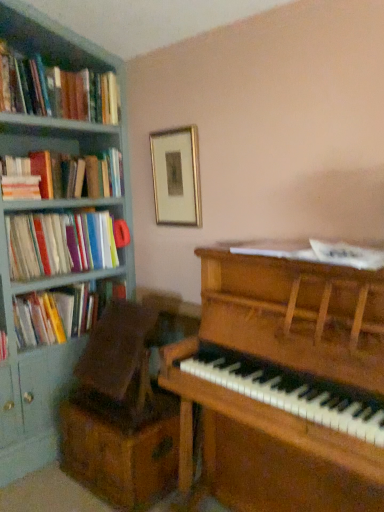
Question: Should I look upward or downward to see hardcover books at left, placed as the first book when sorted from top to bottom?

Choices:
 (A) up
 (B) down

Answer: (A)

Question: Is hardcover books at left, the 3th book in the top-to-bottom sequence, wider than hardcover books at left, placed as the first book when sorted from top to bottom?

Choices:
 (A) no
 (B) yes

Answer: (A)

Question: Is hardcover books at left, marked as the 2th book in a bottom-to-top arrangement, outside hardcover books at left, positioned as the fourth book in bottom-to-top order?

Choices:
 (A) yes
 (B) no

Answer: (A)

Question: Could you tell me if hardcover books at left, the 3th book in the top-to-bottom sequence, is turned towards hardcover books at left, placed as the first book when sorted from top to bottom?

Choices:
 (A) yes
 (B) no

Answer: (B)

Question: From a real-world perspective, does hardcover books at left, marked as the 2th book in a bottom-to-top arrangement, sit lower than hardcover books at left, positioned as the fourth book in bottom-to-top order?

Choices:
 (A) yes
 (B) no

Answer: (A)

Question: Considering the relative positions of hardcover books at left, marked as the 2th book in a bottom-to-top arrangement, and hardcover books at left, placed as the first book when sorted from top to bottom, in the image provided, is hardcover books at left, marked as the 2th book in a bottom-to-top arrangement, to the left of hardcover books at left, placed as the first book when sorted from top to bottom, from the viewer's perspective?

Choices:
 (A) no
 (B) yes

Answer: (B)

Question: Is the position of hardcover books at left, the 3th book in the top-to-bottom sequence, more distant than that of hardcover books at left, positioned as the fourth book in bottom-to-top order?

Choices:
 (A) yes
 (B) no

Answer: (A)

Question: From a real-world perspective, is hardcover books at left, acting as the third book starting from the bottom, on hardcover books at left, placed as the first book when sorted from top to bottom?

Choices:
 (A) yes
 (B) no

Answer: (B)

Question: Is hardcover books at left, acting as the third book starting from the bottom, thinner than hardcover books at left, placed as the first book when sorted from top to bottom?

Choices:
 (A) no
 (B) yes

Answer: (B)

Question: Is hardcover books at left, acting as the third book starting from the bottom, smaller than hardcover books at left, positioned as the fourth book in bottom-to-top order?

Choices:
 (A) no
 (B) yes

Answer: (B)

Question: Does hardcover books at left, the second book positioned from the top, come in front of hardcover books at left, placed as the first book when sorted from top to bottom?

Choices:
 (A) no
 (B) yes

Answer: (A)

Question: Does hardcover books at left, acting as the third book starting from the bottom, turn towards hardcover books at left, placed as the first book when sorted from top to bottom?

Choices:
 (A) yes
 (B) no

Answer: (B)

Question: Is hardcover books at left, the second book positioned from the top, facing away from hardcover books at left, positioned as the fourth book in bottom-to-top order?

Choices:
 (A) yes
 (B) no

Answer: (B)

Question: Is the surface of hardcover book at left, the fourth book when ordered from top to bottom, in direct contact with hardcover books at left, the second book positioned from the top?

Choices:
 (A) yes
 (B) no

Answer: (B)